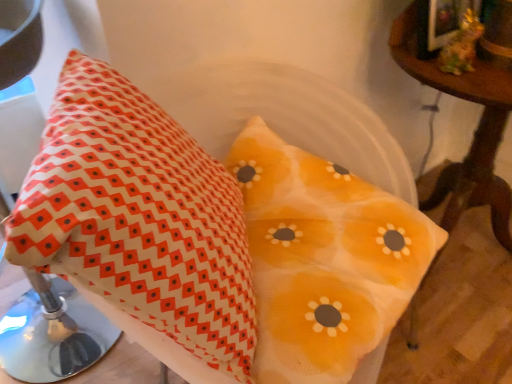
What do you see at coordinates (138, 216) in the screenshot? I see `orange printed pillow at upper left` at bounding box center [138, 216].

This screenshot has height=384, width=512. In order to click on orange printed pillow at upper left in this screenshot , I will do `click(138, 216)`.

Locate an element on the screen. This screenshot has height=384, width=512. orange printed pillow at upper left is located at coordinates (138, 216).